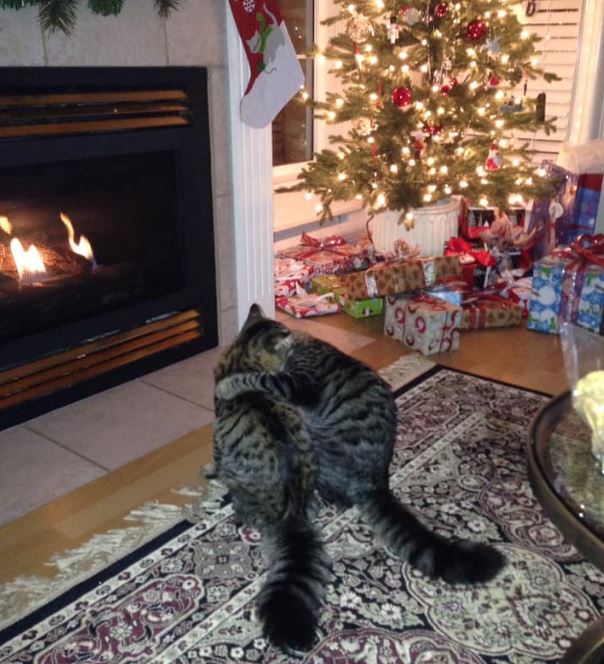
This screenshot has height=664, width=604. Identify the location of christmas stocking. (265, 32).